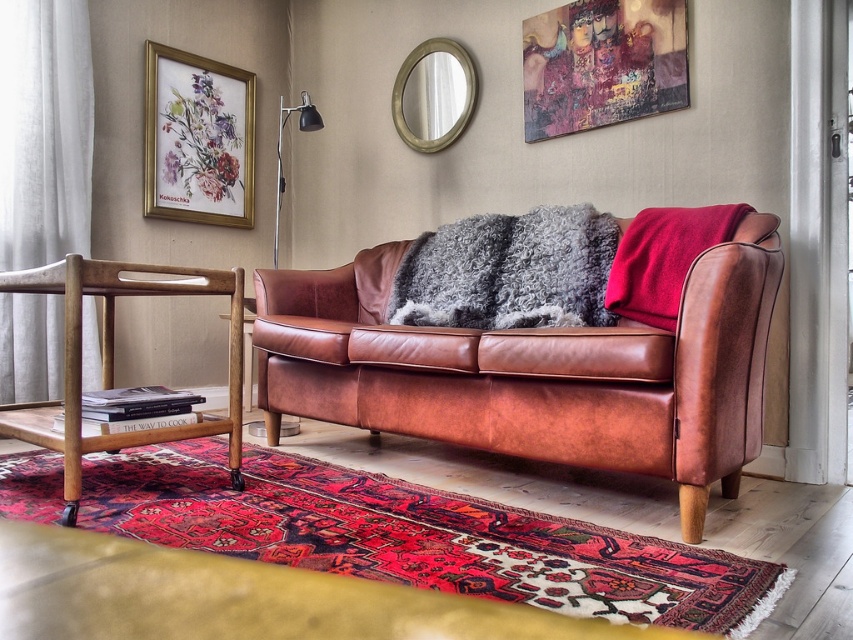
Question: Which point is farther to the camera?

Choices:
 (A) (169, 285)
 (B) (679, 244)
 (C) (387, 332)

Answer: (B)

Question: Which of the following is the farthest from the observer?

Choices:
 (A) gold framed picture at upper left
 (B) gold-framed mirror at upper center

Answer: (A)

Question: Which of the following is the farthest from the observer?

Choices:
 (A) (281, 332)
 (B) (693, 209)
 (C) (171, 168)
 (D) (68, 321)

Answer: (C)

Question: Can you confirm if cognac leather couch at center is positioned to the right of wooden armchair at lower left?

Choices:
 (A) no
 (B) yes

Answer: (B)

Question: Can you confirm if cognac leather couch at center is positioned to the right of velvet red pillow at right?

Choices:
 (A) no
 (B) yes

Answer: (A)

Question: Is gold framed picture at upper left bigger than gold-framed mirror at upper center?

Choices:
 (A) no
 (B) yes

Answer: (B)